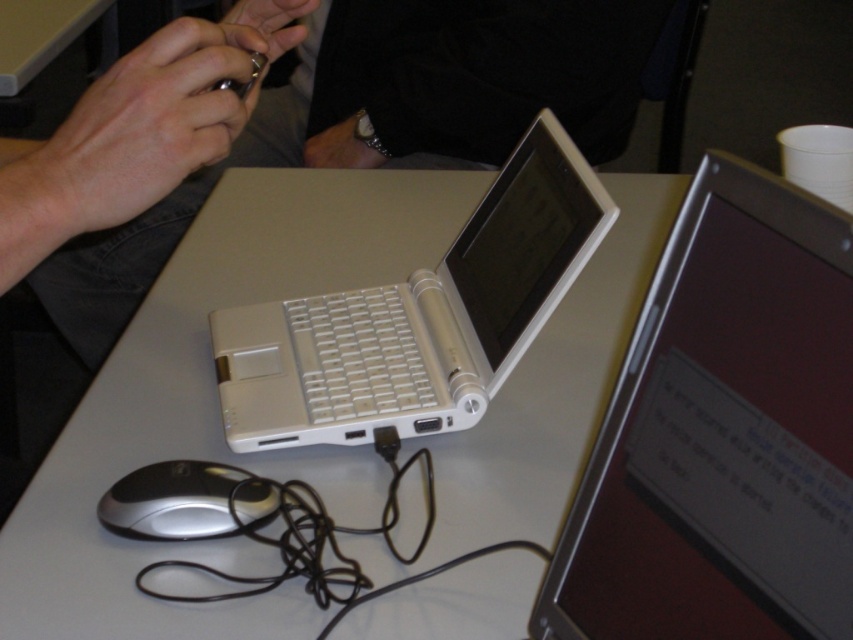
Which is above, silver/black plastic mouse at lower left or metallic silver ring at upper center?

metallic silver ring at upper center is above.

Who is taller, silver/black plastic mouse at lower left or metallic silver ring at upper center?

With more height is metallic silver ring at upper center.

At what (x,y) coordinates should I click in order to perform the action: click on silver/black plastic mouse at lower left. Please return your answer as a coordinate pair (x, y). Looking at the image, I should click on (184, 500).

Does silver metallic laptop at center appear under white plastic laptop at center?

Indeed, silver metallic laptop at center is positioned under white plastic laptop at center.

What do you see at coordinates (723, 435) in the screenshot? I see `silver metallic laptop at center` at bounding box center [723, 435].

Which is behind, point (763, 513) or point (494, 330)?

The point (494, 330) is behind.

The height and width of the screenshot is (640, 853). Identify the location of silver metallic laptop at center. (723, 435).

Who is positioned more to the right, white plastic laptop at center or metallic silver ring at upper center?

white plastic laptop at center is more to the right.

Can you confirm if white plastic laptop at center is taller than metallic silver ring at upper center?

Correct, white plastic laptop at center is much taller as metallic silver ring at upper center.

Is point (519, 324) positioned in front of point (267, 13)?

Yes, point (519, 324) is in front of point (267, 13).

The image size is (853, 640). What are the coordinates of `white plastic laptop at center` in the screenshot? It's located at (416, 317).